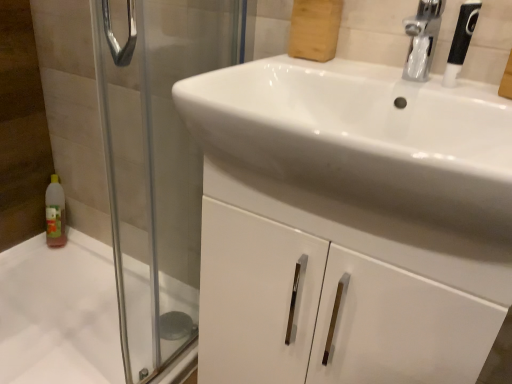
Find the location of `vacant region under transparent glass screen door at left (from a real-world perspective)`. vacant region under transparent glass screen door at left (from a real-world perspective) is located at coordinates point(170,359).